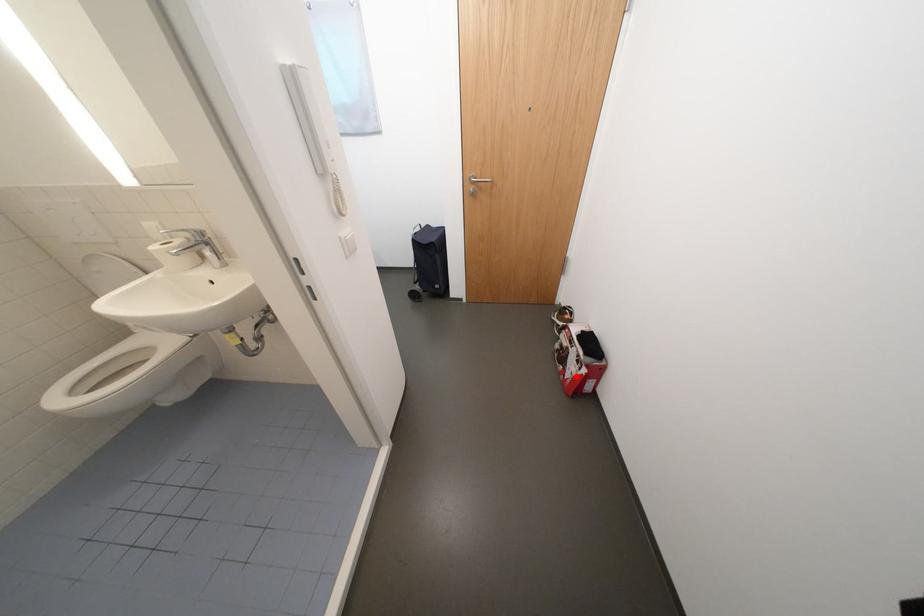
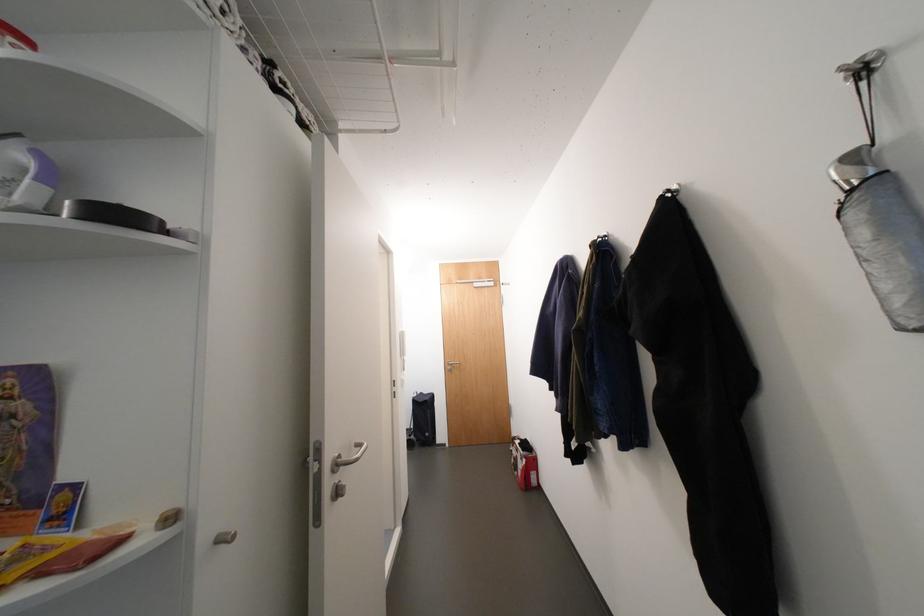
Locate, in the second image, the point that corresponds to the highlighted location in the first image.

(527, 474)